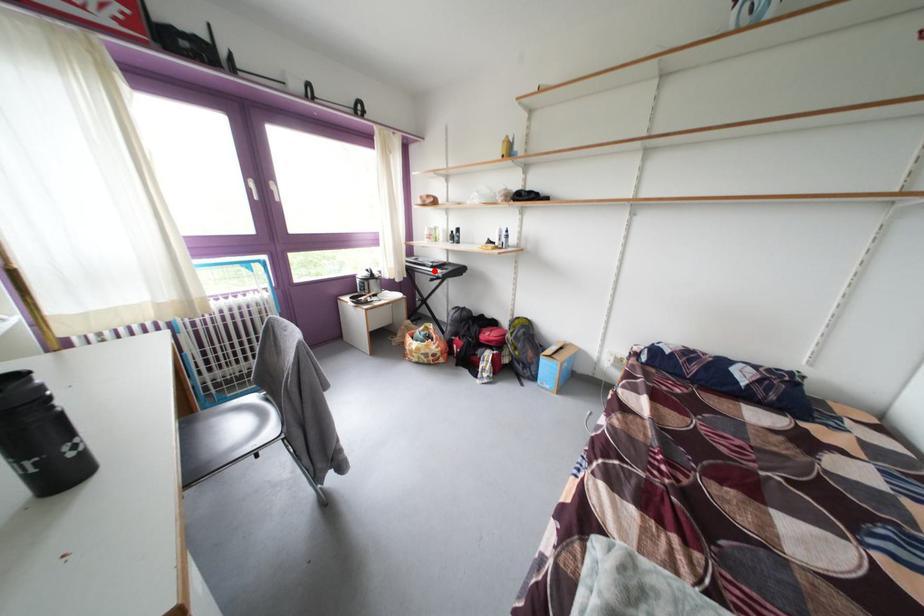
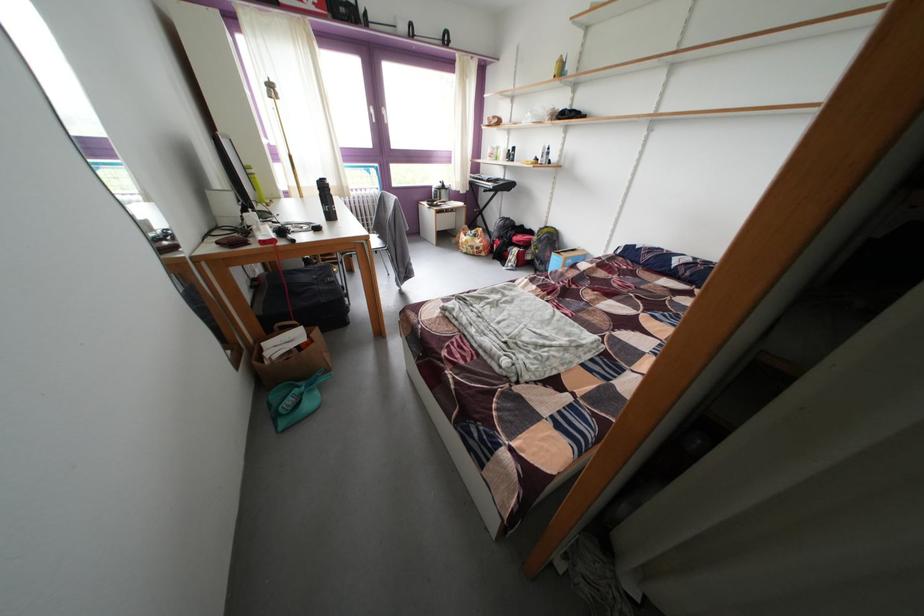
Find the pixel in the second image that matches the highlighted location in the first image.

(492, 185)